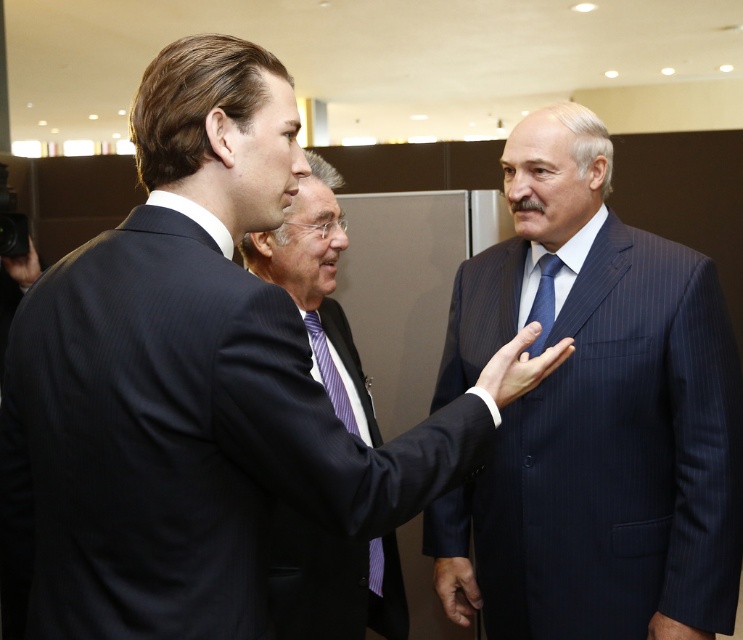
Question: Does purple striped tie at center have a lesser width compared to black smooth hand at lower right?

Choices:
 (A) yes
 (B) no

Answer: (B)

Question: Among these objects, which one is farthest from the camera?

Choices:
 (A) purple striped tie at center
 (B) blue silk tie at center

Answer: (A)

Question: Considering the relative positions of blue pinstripe suit at center and blue silk tie at center in the image provided, where is blue pinstripe suit at center located with respect to blue silk tie at center?

Choices:
 (A) below
 (B) above

Answer: (A)

Question: Which of these objects is positioned farthest from the purple striped tie at center?

Choices:
 (A) black smooth hand at lower right
 (B) dark blue pinstripe suit at center

Answer: (B)

Question: Which point is farther to the camera?

Choices:
 (A) blue silk tie at center
 (B) black smooth hand at lower right

Answer: (B)

Question: Does purple striped tie at center have a larger size compared to blue silk tie at center?

Choices:
 (A) no
 (B) yes

Answer: (B)